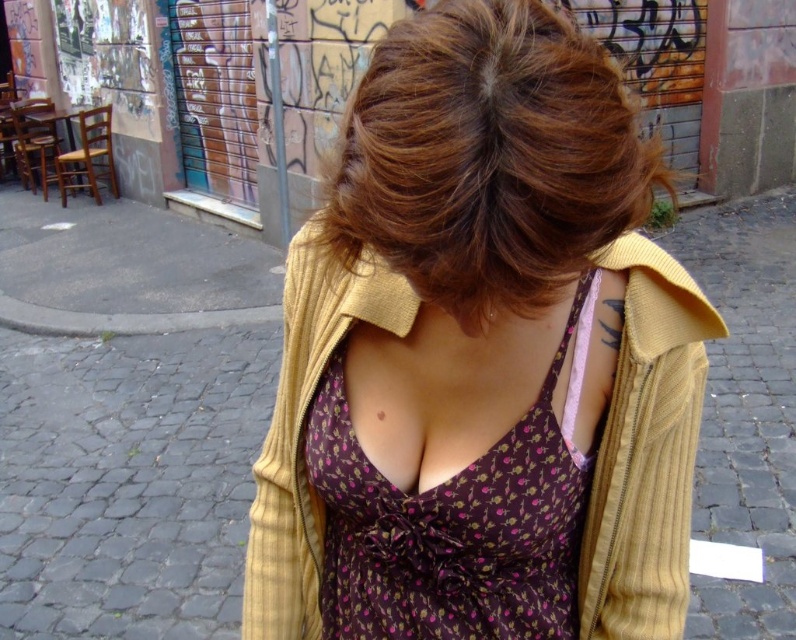
Question: Among these points, which one is farthest from the camera?

Choices:
 (A) (310, 493)
 (B) (621, 148)

Answer: (A)

Question: Which point appears farthest from the camera in this image?

Choices:
 (A) (506, 433)
 (B) (545, 26)
 (C) (467, 300)

Answer: (A)

Question: Does yellow ribbed sweater at center appear on the left side of brown textured hair at center?

Choices:
 (A) yes
 (B) no

Answer: (B)

Question: Is yellow ribbed sweater at center smaller than purple floral fabric dress at center?

Choices:
 (A) no
 (B) yes

Answer: (A)

Question: Which object is closer to the camera taking this photo?

Choices:
 (A) brown textured hair at center
 (B) yellow ribbed sweater at center
 (C) purple floral fabric dress at center

Answer: (B)

Question: Is yellow ribbed sweater at center further to the viewer compared to brown textured hair at center?

Choices:
 (A) no
 (B) yes

Answer: (A)